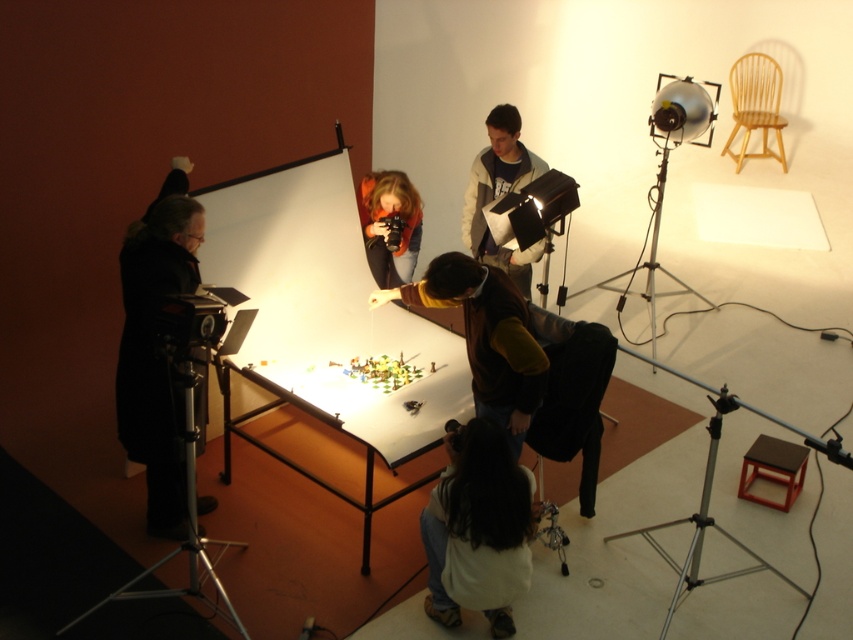
Question: Does matte gray hoodie at center have a larger size compared to matte black camera at center?

Choices:
 (A) yes
 (B) no

Answer: (A)

Question: Which is nearer to the white fabric at lower center?

Choices:
 (A) silver metallic tripod at lower right
 (B) silver metallic tripod at lower left
 (C) white glossy table at center
 (D) matte orange jacket at center

Answer: (C)

Question: Which point is closer to the camera?

Choices:
 (A) matte gray hoodie at center
 (B) matte orange jacket at center
 (C) black matte coat at left
 (D) silver metallic tripod at lower right

Answer: (C)

Question: Is matte orange jacket at center above silver metallic tripod at upper right?

Choices:
 (A) no
 (B) yes

Answer: (A)

Question: Among these points, which one is nearest to the camera?

Choices:
 (A) (408, 250)
 (B) (392, 212)
 (C) (154, 289)

Answer: (C)

Question: Where is silver metallic tripod at upper right located in relation to matte black camera at center in the image?

Choices:
 (A) above
 (B) below

Answer: (A)